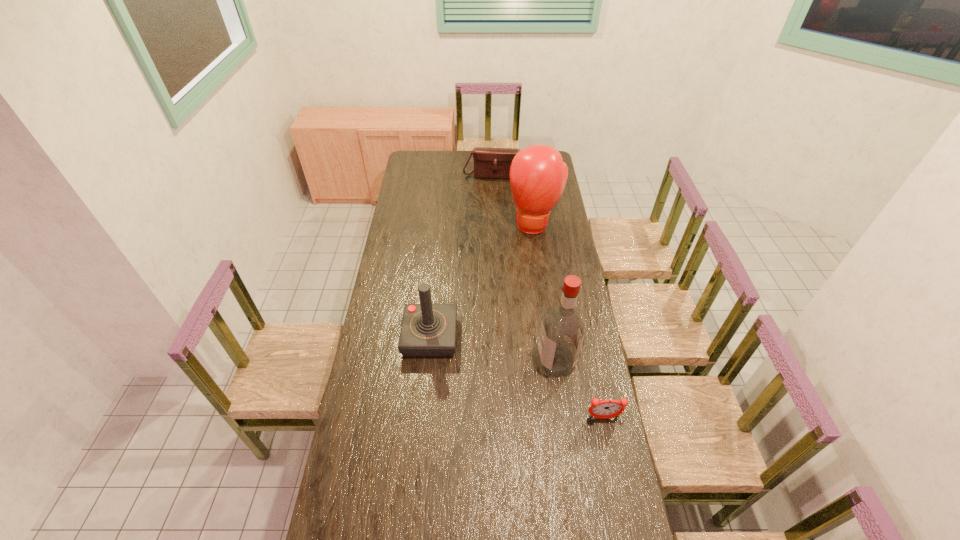
Identify the location of free space that satisfies the following two spatial constraints: 1. on the rectangular base of the joystick; 2. on the right side of the liquor. tap(428, 361).